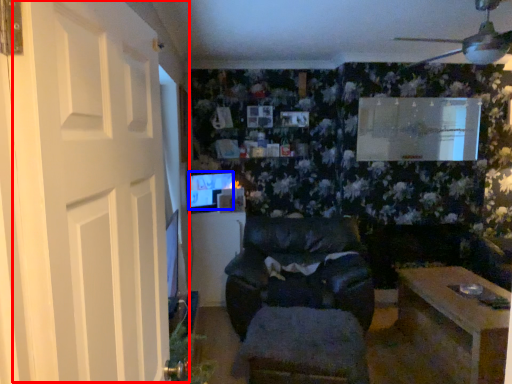
Question: Which point is closer to the camera, door (highlighted by a red box) or computer monitor (highlighted by a blue box)?

Choices:
 (A) door
 (B) computer monitor

Answer: (A)